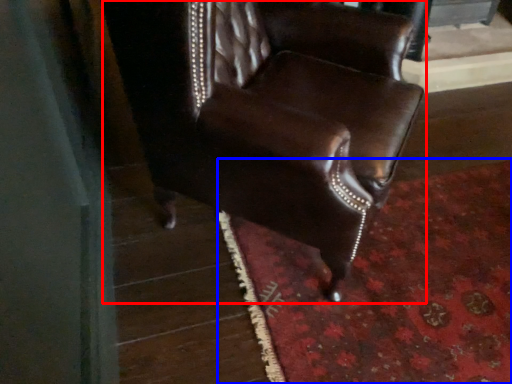
Question: Which object is further to the camera taking this photo, chair (highlighted by a red box) or mat (highlighted by a blue box)?

Choices:
 (A) chair
 (B) mat

Answer: (B)